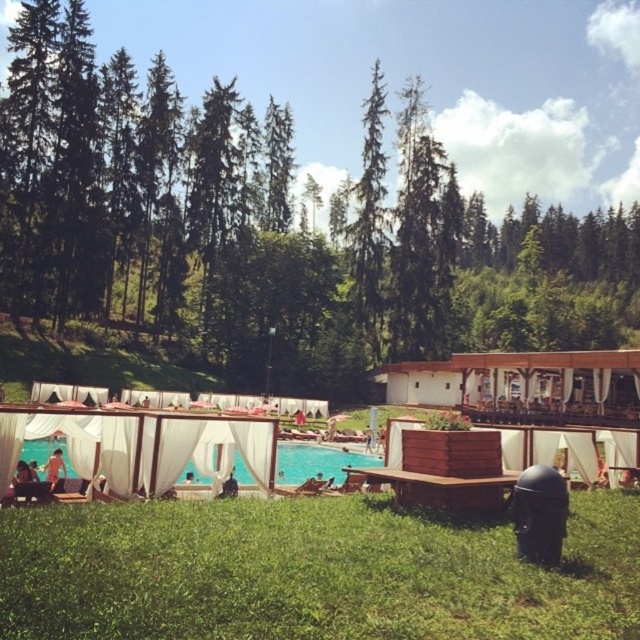
Question: Is green grass at lower center to the left of green textured tree at center from the viewer's perspective?

Choices:
 (A) yes
 (B) no

Answer: (A)

Question: Which of these objects is positioned farthest from the green leafy tree at center?

Choices:
 (A) green textured tree at center
 (B) light brown wooden bench at lower left
 (C) green grass at lower center
 (D) blue glossy pool at center

Answer: (C)

Question: Does green leafy tree at center appear on the left side of green grass at lower center?

Choices:
 (A) yes
 (B) no

Answer: (B)

Question: Where is green leafy tree at center located in relation to blue glossy pool at center in the image?

Choices:
 (A) above
 (B) below

Answer: (A)

Question: Which of these objects is positioned farthest from the light brown wooden bench at lower left?

Choices:
 (A) green grass at lower center
 (B) green leafy tree at center
 (C) blue glossy pool at center

Answer: (B)

Question: Which of the following is the farthest from the observer?

Choices:
 (A) (35, 451)
 (B) (381, 616)
 (C) (29, 184)
 (D) (61, 476)

Answer: (C)